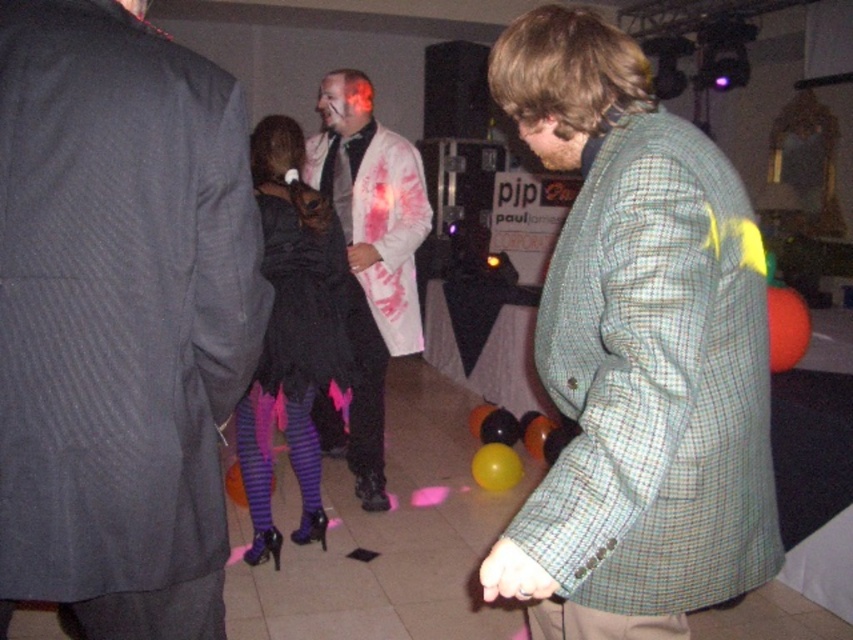
Question: Which of the following is the farthest from the observer?

Choices:
 (A) dark gray suit at left
 (B) black satin dress at center
 (C) black rubber balloon at center
 (D) white textured coat at center

Answer: (C)

Question: Is green checkered jacket at center above white textured coat at center?

Choices:
 (A) no
 (B) yes

Answer: (A)

Question: Which is nearer to the dark gray suit at left?

Choices:
 (A) white textured coat at center
 (B) green checkered jacket at center

Answer: (B)

Question: Estimate the real-world distances between objects in this image. Which object is closer to the black velvet dress at center?

Choices:
 (A) dark gray suit at left
 (B) orange rubber balloon at right
 (C) yellow rubber balloon at center

Answer: (C)

Question: Does black satin dress at center appear under yellow rubber balloon at center?

Choices:
 (A) yes
 (B) no

Answer: (B)

Question: Can you confirm if yellow rubber balloon at center is smaller than black rubber balloon at center?

Choices:
 (A) no
 (B) yes

Answer: (A)